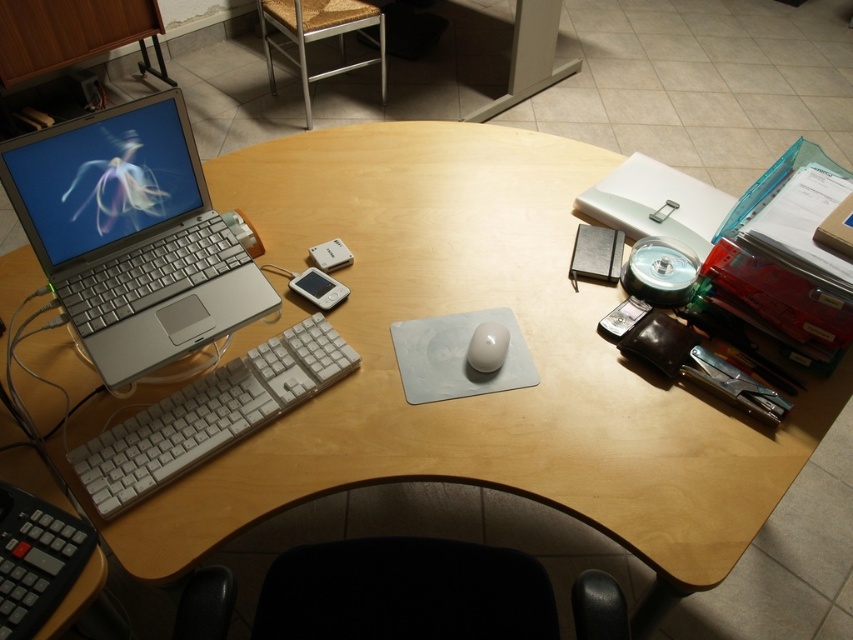
Is silver metallic laptop at left further to the viewer compared to white plastic keyboard at left?

Yes, it is.

Who is positioned more to the right, silver metallic laptop at left or white plastic keyboard at left?

white plastic keyboard at left

Does point (62, 184) come in front of point (312, 356)?

That is True.

Where is `silver metallic laptop at left`? Image resolution: width=853 pixels, height=640 pixels. silver metallic laptop at left is located at coordinates (131, 236).

Can you confirm if white plastic keyboard at left is bigger than white matte mouse at center?

Yes, white plastic keyboard at left is bigger than white matte mouse at center.

Can you confirm if white plastic keyboard at left is positioned to the left of white matte mouse at center?

Yes, white plastic keyboard at left is to the left of white matte mouse at center.

Where is `white plastic keyboard at left`? white plastic keyboard at left is located at coordinates (209, 413).

The height and width of the screenshot is (640, 853). What are the coordinates of `white plastic keyboard at left` in the screenshot? It's located at (209, 413).

Does silver metallic laptop at left appear under white matte mouse at center?

Incorrect, silver metallic laptop at left is not positioned below white matte mouse at center.

Is silver metallic laptop at left thinner than white matte mouse at center?

In fact, silver metallic laptop at left might be wider than white matte mouse at center.

The image size is (853, 640). In order to click on silver metallic laptop at left in this screenshot , I will do `click(131, 236)`.